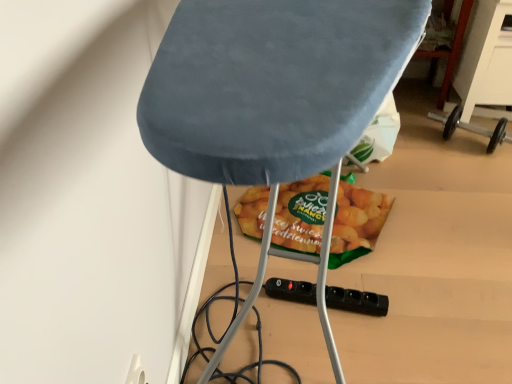
Locate an element on the screen. The width and height of the screenshot is (512, 384). free location to the left of black plastic socket at lower center is located at coordinates (265, 309).